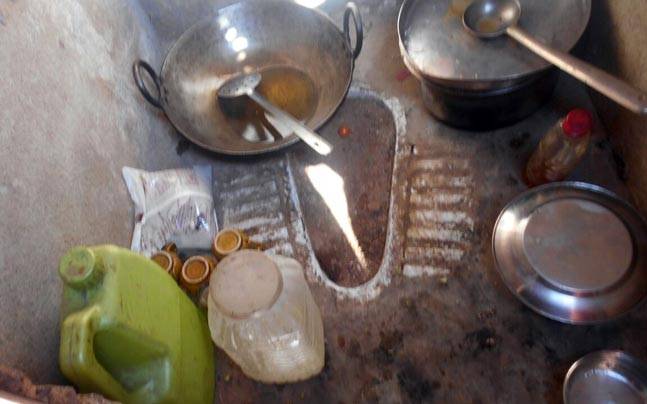
What are the coordinates of `stainless steel plates` in the screenshot? It's located at (561, 255), (596, 383), (497, 60).